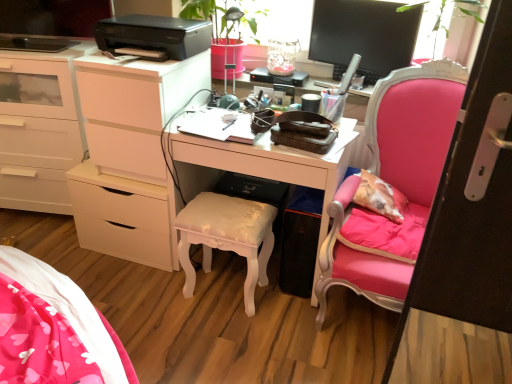
Question: Is white glossy stool at center at the left side of black glossy monitor at upper right?

Choices:
 (A) yes
 (B) no

Answer: (A)

Question: Does white glossy stool at center have a smaller size compared to black glossy monitor at upper right?

Choices:
 (A) no
 (B) yes

Answer: (A)

Question: Is white glossy stool at center in front of black glossy monitor at upper right?

Choices:
 (A) no
 (B) yes

Answer: (B)

Question: From the image's perspective, is white glossy stool at center over black glossy monitor at upper right?

Choices:
 (A) yes
 (B) no

Answer: (B)

Question: From a real-world perspective, does white glossy stool at center stand above black glossy monitor at upper right?

Choices:
 (A) yes
 (B) no

Answer: (B)

Question: Considering the positions of point (203, 39) and point (260, 210), is point (203, 39) closer or farther from the camera than point (260, 210)?

Choices:
 (A) farther
 (B) closer

Answer: (A)

Question: Considering their positions, is black plastic printer at upper center located in front of or behind white glossy stool at center?

Choices:
 (A) behind
 (B) front

Answer: (B)

Question: Looking at the image, does black plastic printer at upper center seem bigger or smaller compared to white glossy stool at center?

Choices:
 (A) small
 (B) big

Answer: (A)

Question: Is black plastic printer at upper center to the left or to the right of white glossy stool at center in the image?

Choices:
 (A) right
 (B) left

Answer: (B)

Question: Does point (370, 6) appear closer or farther from the camera than point (443, 119)?

Choices:
 (A) farther
 (B) closer

Answer: (A)

Question: Is black glossy monitor at upper right in front of or behind pink velvet chair at right in the image?

Choices:
 (A) behind
 (B) front

Answer: (A)

Question: Considering the positions of black glossy monitor at upper right and pink velvet chair at right in the image, is black glossy monitor at upper right wider or thinner than pink velvet chair at right?

Choices:
 (A) wide
 (B) thin

Answer: (B)

Question: Based on their sizes in the image, would you say black glossy monitor at upper right is bigger or smaller than pink velvet chair at right?

Choices:
 (A) big
 (B) small

Answer: (B)

Question: From the image's perspective, relative to white glossy chest of drawers at left, is pink velvet chair at right above or below?

Choices:
 (A) below
 (B) above

Answer: (A)

Question: From their relative heights in the image, would you say pink velvet chair at right is taller or shorter than white glossy chest of drawers at left?

Choices:
 (A) tall
 (B) short

Answer: (A)